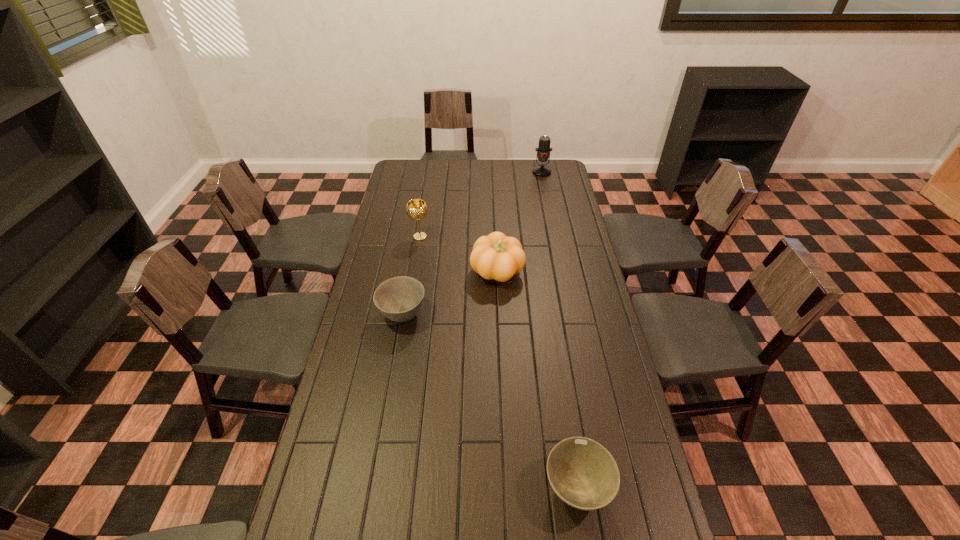
Where is `vacant region between the left bowl and the third farthest object`? vacant region between the left bowl and the third farthest object is located at coordinates (449, 293).

At what (x,y) coordinates should I click in order to perform the action: click on empty space between the left bowl and the fourth nearest object. Please return your answer as a coordinate pair (x, y). This screenshot has height=540, width=960. Looking at the image, I should click on (411, 275).

This screenshot has width=960, height=540. Identify the location of object that is the third closest to the microphone. (399, 299).

Choose which object is the second nearest neighbor to the farther bowl. Please provide its 2D coordinates. Your answer should be formatted as a tuple, i.e. [(x, y)], where the tuple contains the x and y coordinates of a point satisfying the conditions above.

[(416, 209)]